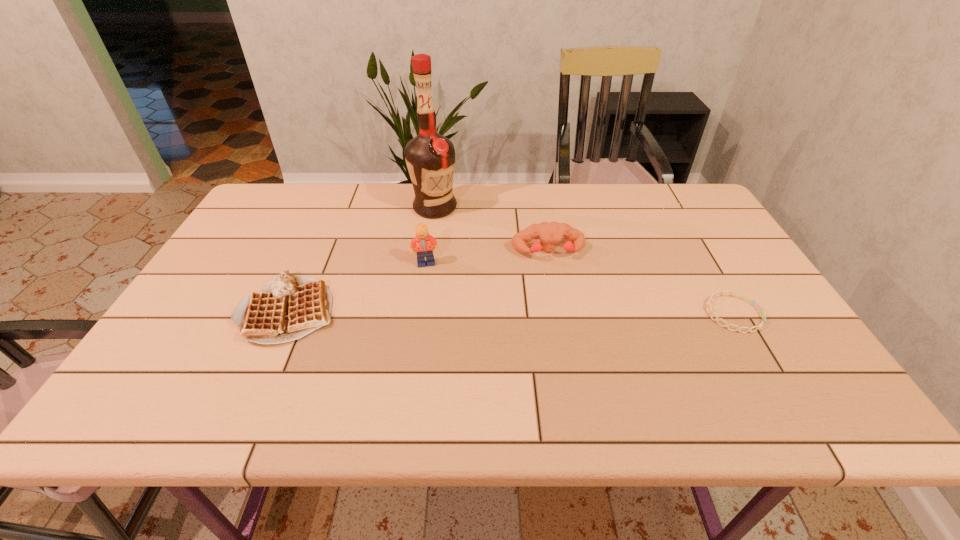
Locate an element on the screen. This screenshot has width=960, height=540. the second shortest object is located at coordinates (289, 307).

I want to click on waffle, so click(289, 307).

At what (x,y) coordinates should I click in order to perform the action: click on the rightmost object. Please return your answer as a coordinate pair (x, y). Looking at the image, I should click on (747, 298).

Locate an element on the screen. bracelet is located at coordinates (747, 298).

Locate an element on the screen. This screenshot has height=540, width=960. the farthest object is located at coordinates (430, 157).

Locate an element on the screen. This screenshot has width=960, height=540. the tallest object is located at coordinates (430, 157).

Identify the location of puncher. The width and height of the screenshot is (960, 540). (549, 234).

The image size is (960, 540). I want to click on the third tallest object, so click(549, 234).

Locate an element on the screen. Image resolution: width=960 pixels, height=540 pixels. Lego is located at coordinates (423, 243).

Locate an element on the screen. The width and height of the screenshot is (960, 540). free space located 0.050m on the left of the waffle is located at coordinates (220, 310).